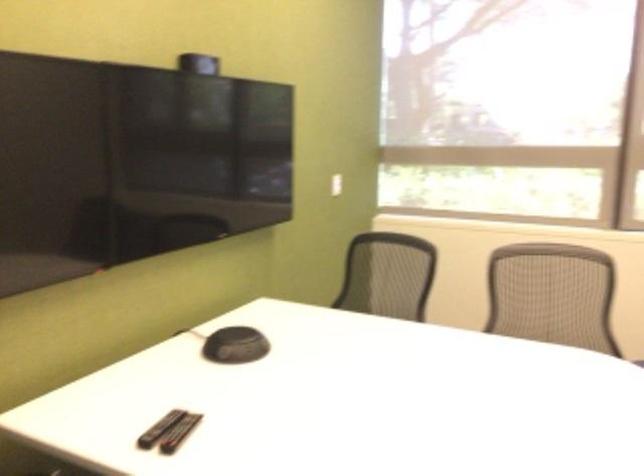
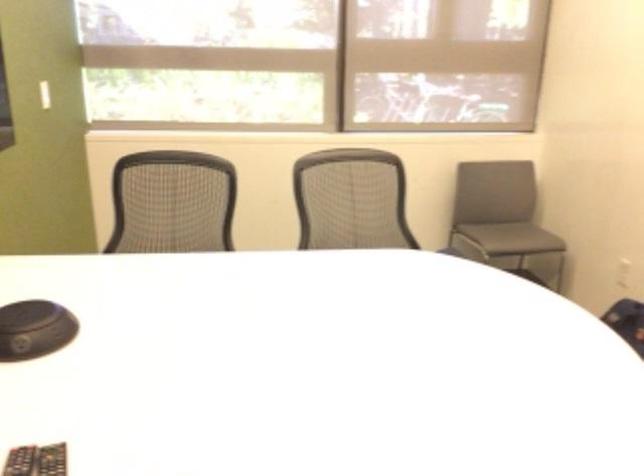
Question: The camera is either moving clockwise (left) or counter-clockwise (right) around the object. The first image is from the beginning of the video and the second image is from the end. Is the camera moving left or right when shooting the video?

Choices:
 (A) Left
 (B) Right

Answer: (A)